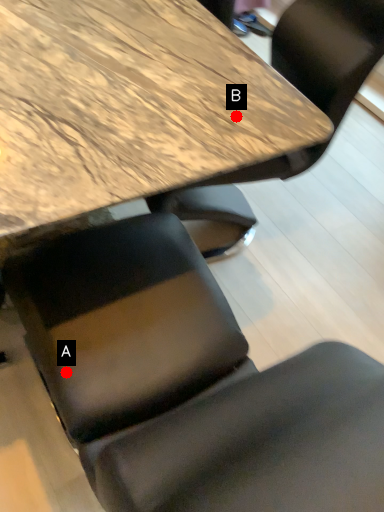
Question: Two points are circled on the image, labeled by A and B beside each circle. Which point is further to the camera?

Choices:
 (A) A is further
 (B) B is further

Answer: (B)